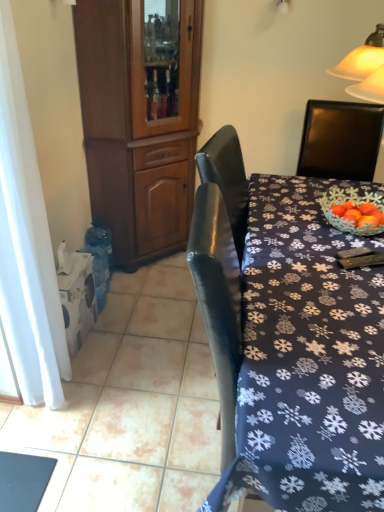
This screenshot has width=384, height=512. Find the location of `vacant area situated below white sheer curtain at left (from a real-world perspective)`. vacant area situated below white sheer curtain at left (from a real-world perspective) is located at coordinates (71, 391).